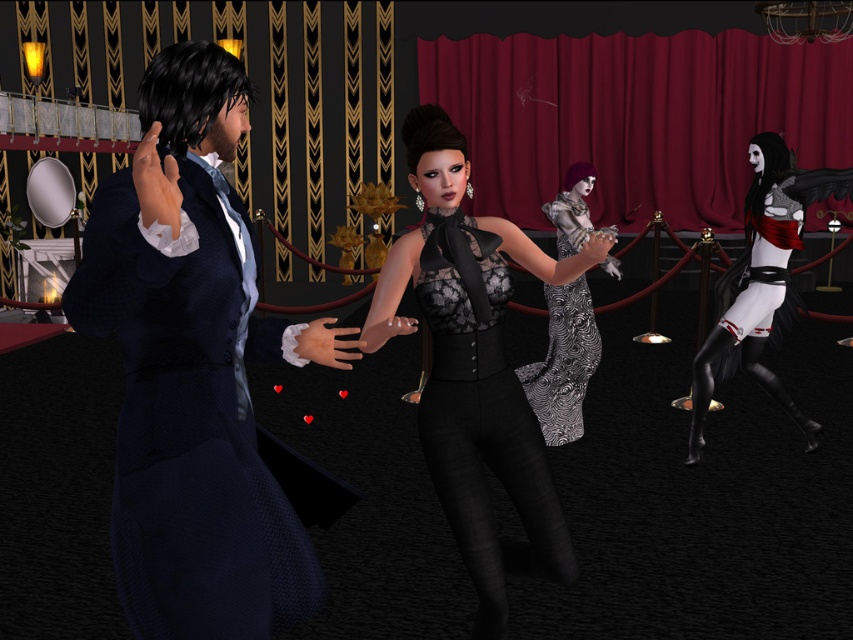
Question: Can you confirm if velvet blue suit at left is smaller than lace fabric dress at center?

Choices:
 (A) no
 (B) yes

Answer: (A)

Question: Which object is farther from the camera taking this photo?

Choices:
 (A) lace fabric dress at center
 (B) white matte dress at right
 (C) silver metallic dress at center
 (D) velvet blue suit at left

Answer: (B)

Question: Which of the following is the farthest from the observer?

Choices:
 (A) white matte dress at right
 (B) velvet blue suit at left
 (C) silver metallic dress at center
 (D) lace fabric dress at center

Answer: (A)

Question: Does white matte dress at right have a larger size compared to silver metallic dress at center?

Choices:
 (A) no
 (B) yes

Answer: (B)

Question: Is lace fabric dress at center wider than white matte dress at right?

Choices:
 (A) no
 (B) yes

Answer: (A)

Question: Which object is positioned farthest from the velvet blue suit at left?

Choices:
 (A) silver metallic dress at center
 (B) lace fabric dress at center
 (C) white matte dress at right

Answer: (C)